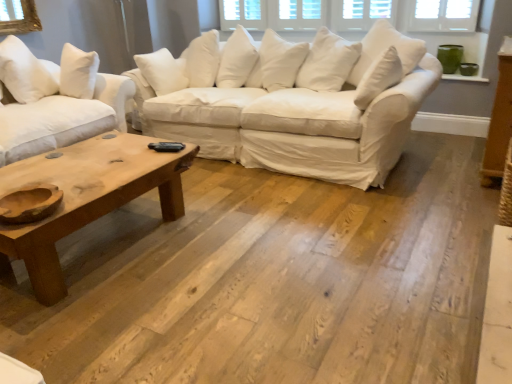
This screenshot has height=384, width=512. Identify the location of vacant area that is situated to the right of natural wood coffee table at lower left. (241, 257).